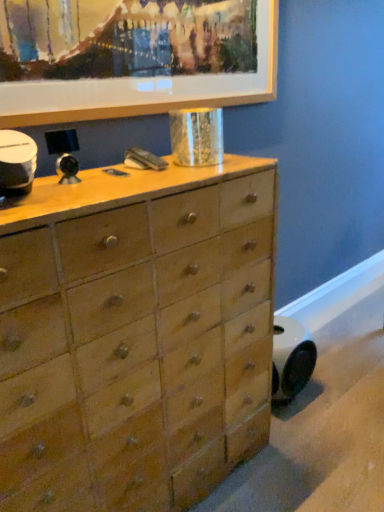
The height and width of the screenshot is (512, 384). Describe the element at coordinates (132, 57) in the screenshot. I see `wooden picture frame at upper center` at that location.

I want to click on wooden picture frame at upper center, so 132,57.

Measure the distance between point (196,285) and camera.

They are 1.15 meters apart.

Where is `natural wood chest of drawers at center`? natural wood chest of drawers at center is located at coordinates (135, 336).

Describe the element at coordinates (135, 336) in the screenshot. Image resolution: width=384 pixels, height=512 pixels. I see `natural wood chest of drawers at center` at that location.

Identify the location of wooden picture frame at upper center. The image size is (384, 512). (132, 57).

Between wooden picture frame at upper center and natural wood chest of drawers at center, which one appears on the right side from the viewer's perspective?

wooden picture frame at upper center is more to the right.

Considering the relative positions of wooden picture frame at upper center and natural wood chest of drawers at center in the image provided, is wooden picture frame at upper center behind natural wood chest of drawers at center?

Yes, wooden picture frame at upper center is further from the camera.

Is point (89, 5) closer or farther from the camera than point (35, 263)?

Point (89, 5) appears to be farther away from the viewer than point (35, 263).

From the image's perspective, is wooden picture frame at upper center above or below natural wood chest of drawers at center?

wooden picture frame at upper center is situated higher than natural wood chest of drawers at center in the image.

From a real-world perspective, which is physically below, wooden picture frame at upper center or natural wood chest of drawers at center?

From a 3D spatial view, natural wood chest of drawers at center is below.

Considering the sizes of wooden picture frame at upper center and natural wood chest of drawers at center in the image, is wooden picture frame at upper center wider or thinner than natural wood chest of drawers at center?

wooden picture frame at upper center is thinner than natural wood chest of drawers at center.

Considering the sizes of objects wooden picture frame at upper center and natural wood chest of drawers at center in the image provided, who is shorter, wooden picture frame at upper center or natural wood chest of drawers at center?

wooden picture frame at upper center is shorter.

Who is bigger, wooden picture frame at upper center or natural wood chest of drawers at center?

With larger size is natural wood chest of drawers at center.

Can we say wooden picture frame at upper center lies outside natural wood chest of drawers at center?

Yes, wooden picture frame at upper center is outside of natural wood chest of drawers at center.

Is wooden picture frame at upper center not close to natural wood chest of drawers at center?

No, there isn't a large distance between wooden picture frame at upper center and natural wood chest of drawers at center.

Is wooden picture frame at upper center looking in the opposite direction of natural wood chest of drawers at center?

No, wooden picture frame at upper center is not facing the opposite direction of natural wood chest of drawers at center.

How many degrees apart are the facing directions of wooden picture frame at upper center and natural wood chest of drawers at center?

The angular difference between wooden picture frame at upper center and natural wood chest of drawers at center is 0.0336 degrees.

The image size is (384, 512). In order to click on chest of drawers on the left of the wooden picture frame at upper center in this screenshot , I will do `click(135, 336)`.

Is natural wood chest of drawers at center to the left of wooden picture frame at upper center from the viewer's perspective?

Correct, you'll find natural wood chest of drawers at center to the left of wooden picture frame at upper center.

Who is more distant, natural wood chest of drawers at center or wooden picture frame at upper center?

wooden picture frame at upper center is behind.

Does point (11, 314) come in front of point (72, 8)?

Yes, it is.

From the image's perspective, is natural wood chest of drawers at center above or below wooden picture frame at upper center?

natural wood chest of drawers at center is below wooden picture frame at upper center.

From a real-world perspective, is natural wood chest of drawers at center positioned above or below wooden picture frame at upper center?

In terms of real-world spatial position, natural wood chest of drawers at center is below wooden picture frame at upper center.

Which object is thinner, natural wood chest of drawers at center or wooden picture frame at upper center?

With smaller width is wooden picture frame at upper center.

Can you confirm if natural wood chest of drawers at center is taller than wooden picture frame at upper center?

Yes, natural wood chest of drawers at center is taller than wooden picture frame at upper center.

Considering the relative sizes of natural wood chest of drawers at center and wooden picture frame at upper center in the image provided, is natural wood chest of drawers at center smaller than wooden picture frame at upper center?

No.

Can we say natural wood chest of drawers at center lies outside wooden picture frame at upper center?

natural wood chest of drawers at center is positioned outside wooden picture frame at upper center.

Are natural wood chest of drawers at center and wooden picture frame at upper center making contact?

No, natural wood chest of drawers at center is not beside wooden picture frame at upper center.

Could you tell me if natural wood chest of drawers at center is turned towards wooden picture frame at upper center?

No, natural wood chest of drawers at center is not facing towards wooden picture frame at upper center.

The width and height of the screenshot is (384, 512). What are the coordinates of `picture frame above the natural wood chest of drawers at center (from a real-world perspective)` in the screenshot? It's located at (132, 57).

Where is `chest of drawers on the left of wooden picture frame at upper center`? This screenshot has width=384, height=512. chest of drawers on the left of wooden picture frame at upper center is located at coordinates [135, 336].

Identify the location of picture frame to the right of natural wood chest of drawers at center. point(132,57).